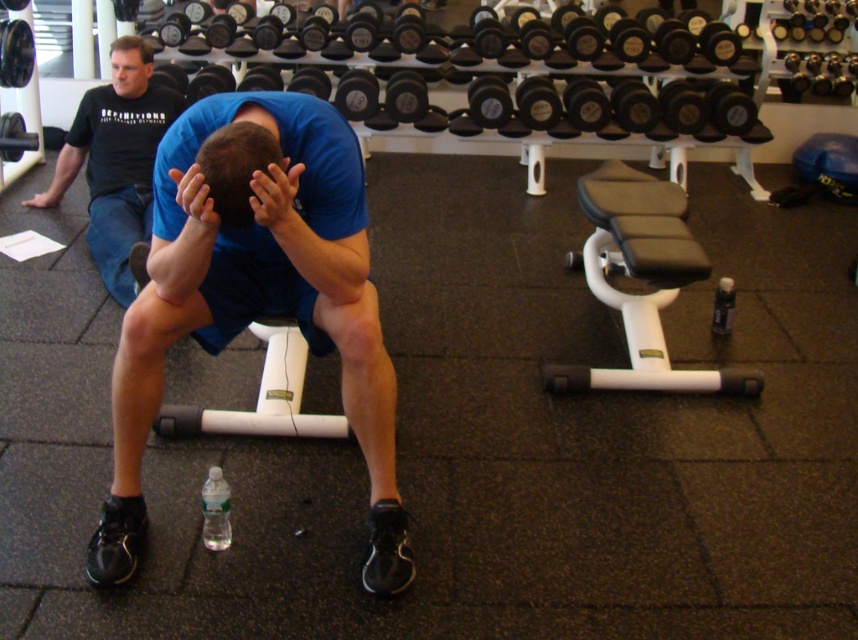
Question: Estimate the real-world distances between objects in this image. Which object is farther from the smooth skin head at upper left?

Choices:
 (A) blue matte/suede squat at center
 (B) dark blue fabric head at center

Answer: (B)

Question: Which object appears farthest from the camera in this image?

Choices:
 (A) matte black hand at upper left
 (B) blue matte/suede squat at center
 (C) matte skin hand at center

Answer: (A)

Question: Considering the real-world distances, which object is closest to the smooth skin head at upper left?

Choices:
 (A) blue matte/suede squat at center
 (B) matte blue hands at center
 (C) matte black hand at upper left
 (D) dark blue fabric head at center

Answer: (C)

Question: Is black cotton shirt at upper left above matte black hand at upper left?

Choices:
 (A) yes
 (B) no

Answer: (B)

Question: Is dark blue fabric head at center smaller than matte black hand at upper left?

Choices:
 (A) no
 (B) yes

Answer: (B)

Question: Does blue matte/suede squat at center have a greater width compared to matte skin hand at center?

Choices:
 (A) yes
 (B) no

Answer: (A)